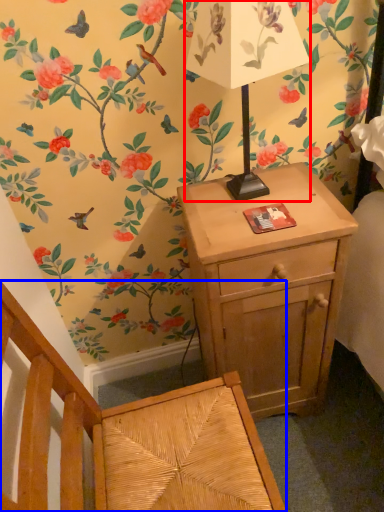
Question: Which object is closer to the camera taking this photo, table lamp (highlighted by a red box) or armchair (highlighted by a blue box)?

Choices:
 (A) table lamp
 (B) armchair

Answer: (B)